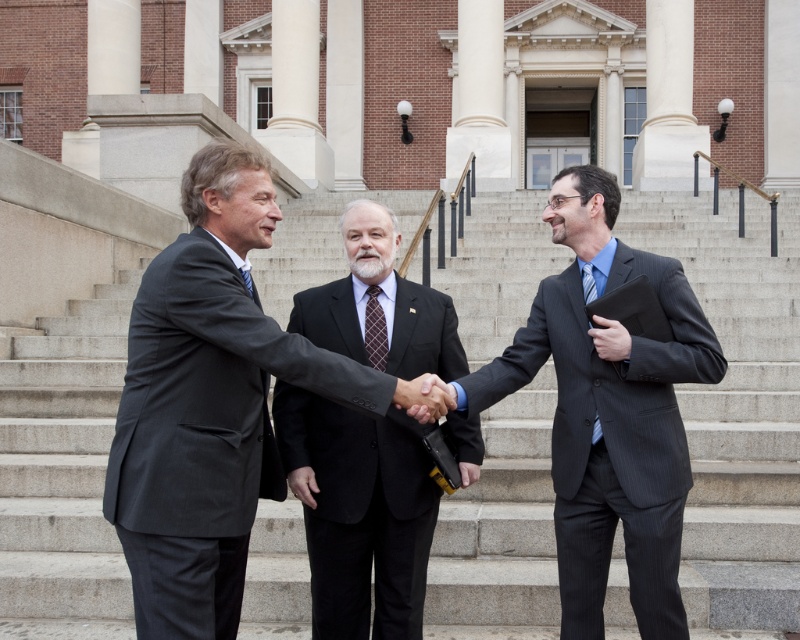
Question: Does gray concrete stairs at center have a greater width compared to dark brown textured tie at center?

Choices:
 (A) yes
 (B) no

Answer: (A)

Question: Is the position of matte black suit at center more distant than that of dark gray pinstripe suit at center?

Choices:
 (A) no
 (B) yes

Answer: (A)

Question: Which object appears farthest from the camera in this image?

Choices:
 (A) dark gray suit at center
 (B) dark brown textured tie at center

Answer: (B)

Question: Which point appears closest to the camera in this image?

Choices:
 (A) (249, 280)
 (B) (582, 220)
 (C) (56, 445)
 (D) (382, 328)

Answer: (A)

Question: Is matte black suit at center bigger than dark blue textured tie at center?

Choices:
 (A) yes
 (B) no

Answer: (A)

Question: Which point is farther from the camera taking this photo?

Choices:
 (A) (550, 205)
 (B) (266, 300)
 (C) (258, 348)
 (D) (624, 328)

Answer: (B)